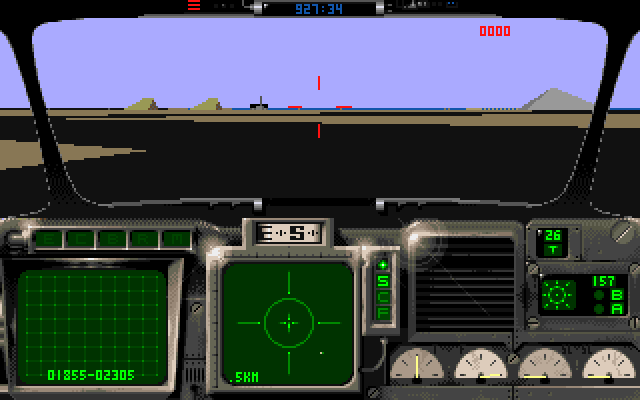
You are a GUI agent. You are given a task and a screenshot of the screen. Output one action in this format:
    pyautogui.click(x=<x>, y=<y>)
    Task: Click on the red counter
    The image size is (640, 400).
    Given the screenshot: What is the action you would take?
    pyautogui.click(x=490, y=33)